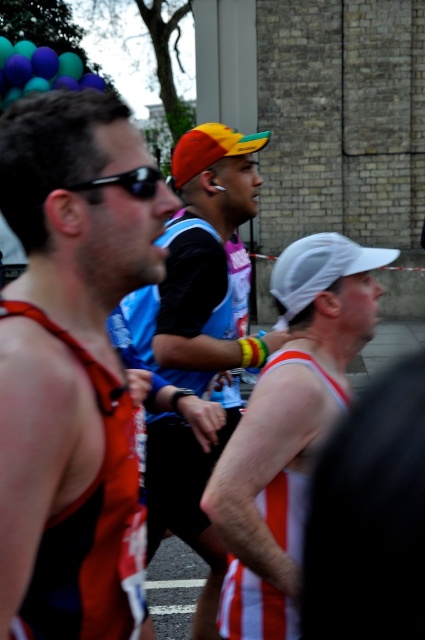
Can you confirm if orange fabric cap at center is positioned to the left of translucent plastic balloons at upper left?

In fact, orange fabric cap at center is to the right of translucent plastic balloons at upper left.

Can you confirm if orange fabric cap at center is positioned to the right of translucent plastic balloons at upper left?

Yes, orange fabric cap at center is to the right of translucent plastic balloons at upper left.

What do you see at coordinates (201, 264) in the screenshot? I see `orange fabric cap at center` at bounding box center [201, 264].

The height and width of the screenshot is (640, 425). What are the coordinates of `orange fabric cap at center` in the screenshot? It's located at (201, 264).

Between translucent plastic balloons at upper left and black plastic sunglasses at upper left, which one is positioned higher?

Positioned higher is translucent plastic balloons at upper left.

The height and width of the screenshot is (640, 425). I want to click on translucent plastic balloons at upper left, so click(39, 70).

Is point (34, 60) closer to viewer compared to point (132, 180)?

No.

Image resolution: width=425 pixels, height=640 pixels. Find the location of `translucent plastic balloons at upper left`. translucent plastic balloons at upper left is located at coordinates [x=39, y=70].

Is white mesh cap at center above translucent plastic balloons at upper left?

Actually, white mesh cap at center is below translucent plastic balloons at upper left.

Which is behind, point (244, 552) or point (45, 88)?

Positioned behind is point (45, 88).

You are a GUI agent. You are given a task and a screenshot of the screen. Output one action in this format:
    pyautogui.click(x=<x>, y=<y>)
    Task: Click on the white mesh cap at center
    
    Given the screenshot: What is the action you would take?
    pyautogui.click(x=289, y=429)